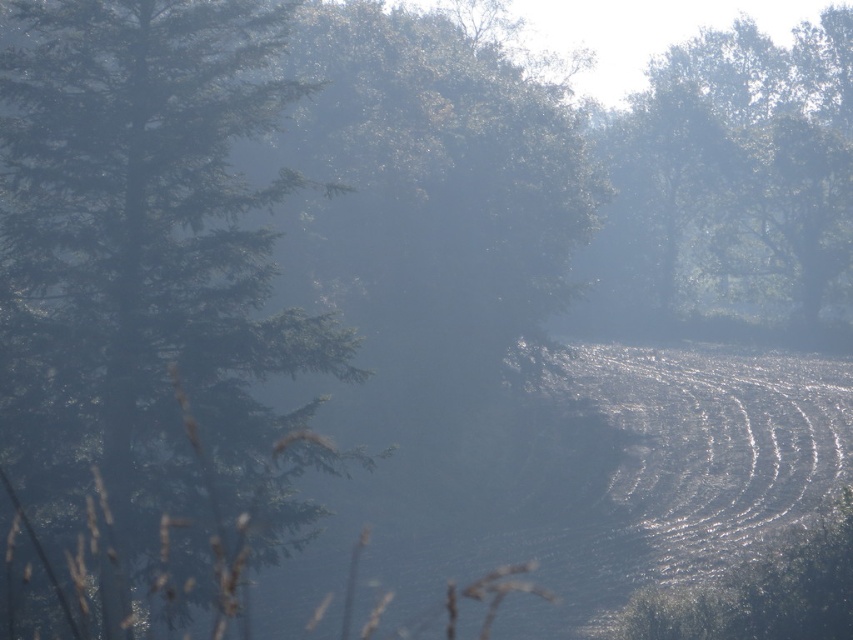
Does green matte tree at left have a larger size compared to green leafy tree at upper right?

Actually, green matte tree at left might be smaller than green leafy tree at upper right.

Image resolution: width=853 pixels, height=640 pixels. What do you see at coordinates (148, 310) in the screenshot? I see `green matte tree at left` at bounding box center [148, 310].

Where is `green matte tree at left`? green matte tree at left is located at coordinates (148, 310).